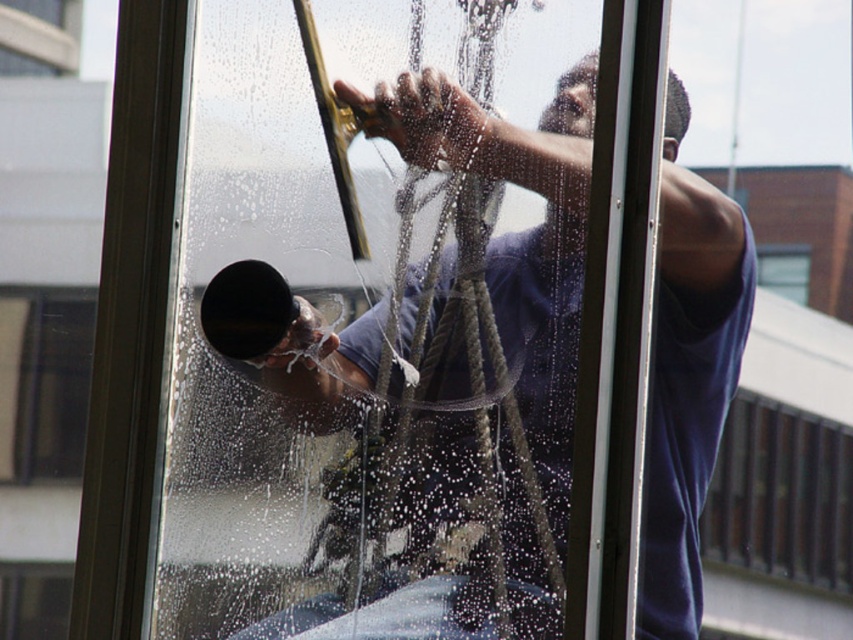
Is dark blue shirt at center positioned at the back of transparent glass window at upper center?

That is False.

Looking at this image, between dark blue shirt at center and transparent glass window at upper center, which one is positioned higher?

transparent glass window at upper center

Locate an element on the screen. This screenshot has width=853, height=640. dark blue shirt at center is located at coordinates (521, 237).